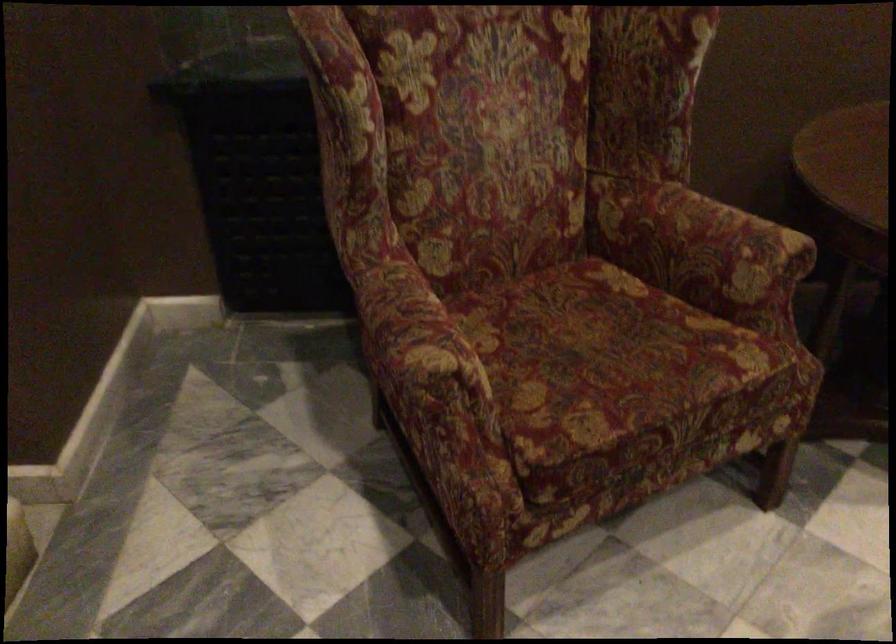
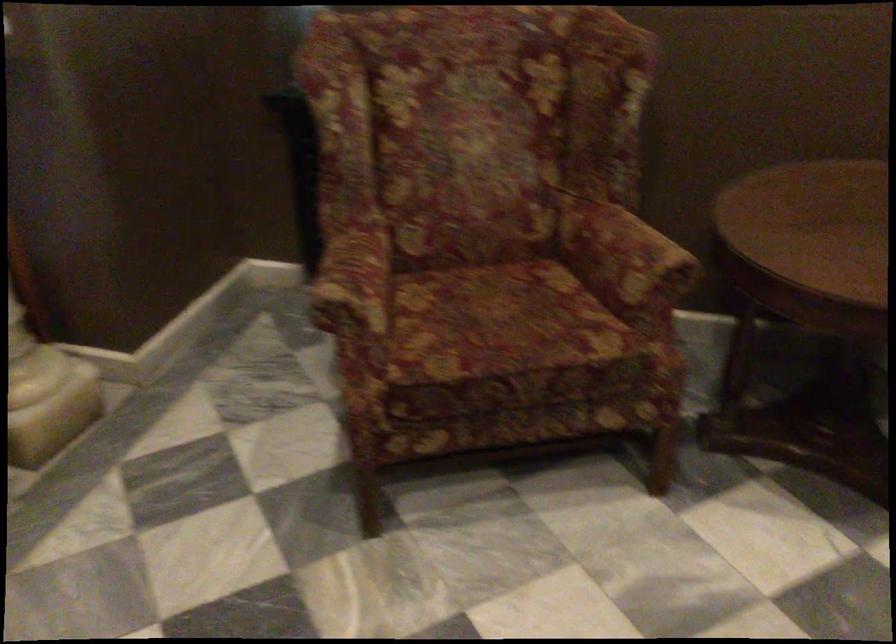
Question: The images are taken continuously from a first-person perspective. In which direction is your viewpoint rotating?

Choices:
 (A) Left
 (B) Right
 (C) Up
 (D) Down

Answer: (A)